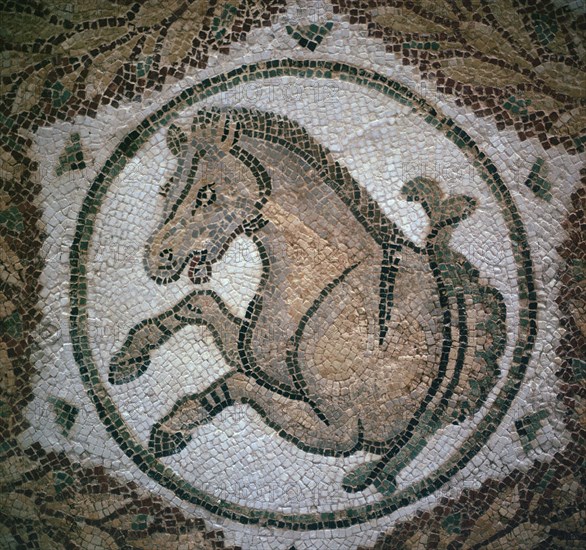
Locate an element on the screen. tiles is located at coordinates (263, 428).